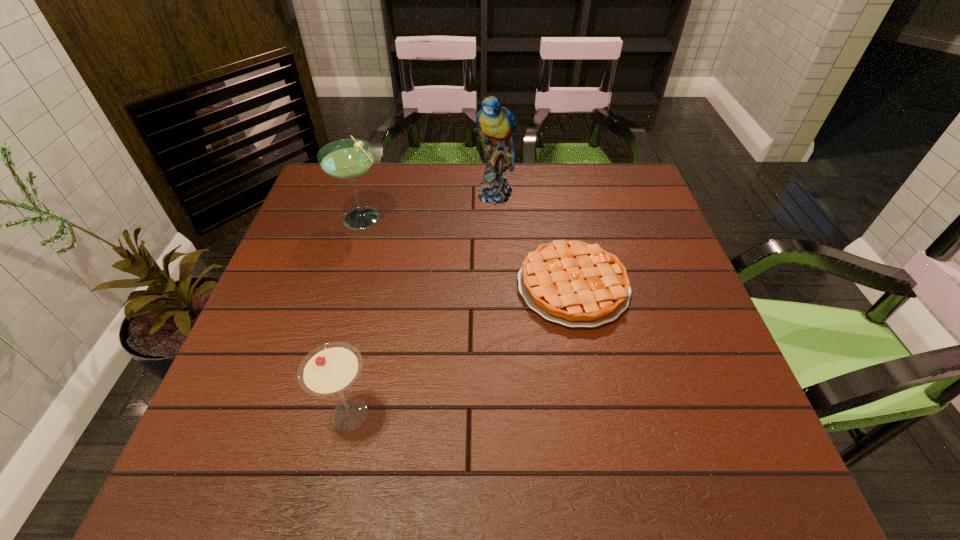
This screenshot has width=960, height=540. In the image, there is a desktop. What are the coordinates of `free region at the right edge` in the screenshot? It's located at (636, 241).

At what (x,y) coordinates should I click in order to perform the action: click on free space at the far left corner of the desktop. Please return your answer as a coordinate pair (x, y). Looking at the image, I should click on (342, 193).

The width and height of the screenshot is (960, 540). I want to click on vacant space that's between the farther martini and the parrot, so click(429, 205).

Image resolution: width=960 pixels, height=540 pixels. Find the location of `empty space that is in between the tallest object and the shorter martini`. empty space that is in between the tallest object and the shorter martini is located at coordinates (422, 304).

Locate an element on the screen. free space between the parrot and the farther martini is located at coordinates (429, 205).

Find the location of a particular element. Image resolution: width=960 pixels, height=540 pixels. vacant area between the nearest object and the parrot is located at coordinates (422, 304).

The width and height of the screenshot is (960, 540). Identify the location of empty space that is in between the parrot and the shortest object. (534, 240).

Find the location of a particular element. This screenshot has height=540, width=960. free point between the nearer martini and the tallest object is located at coordinates (422, 304).

This screenshot has height=540, width=960. What are the coordinates of `empty space between the third tallest object and the parrot` in the screenshot? It's located at (422, 304).

I want to click on free space between the parrot and the second tallest object, so [429, 205].